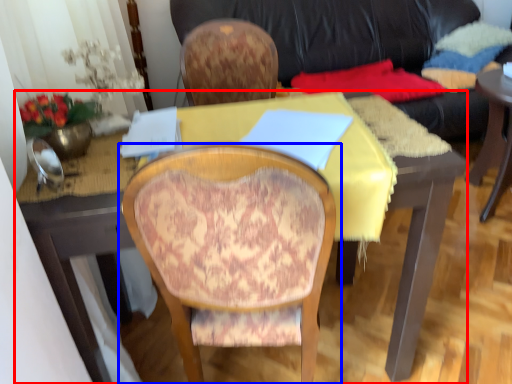
Question: Which of the following is the farthest to the observer, desk (highlighted by a red box) or chair (highlighted by a blue box)?

Choices:
 (A) desk
 (B) chair

Answer: (A)